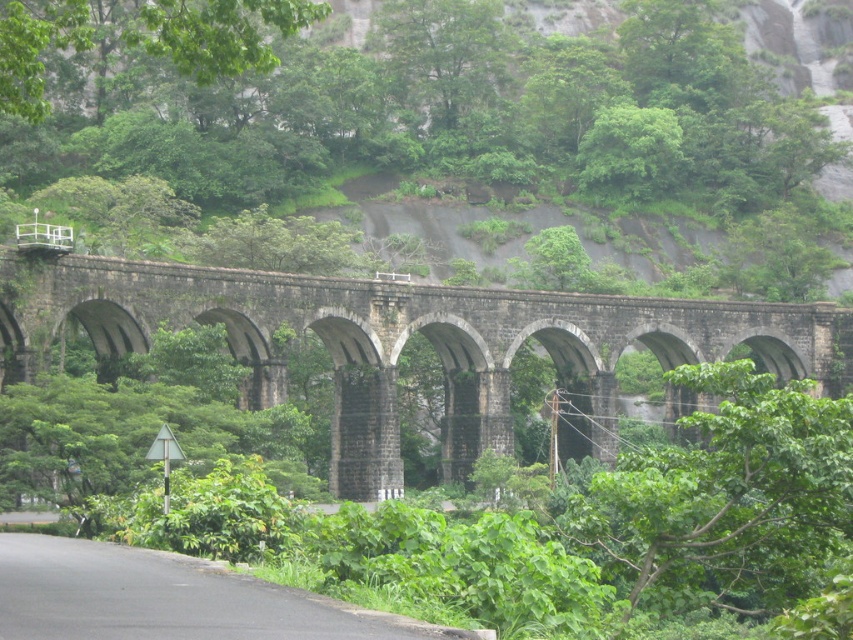
You are a hiker standing on the path near the dark gray stone bridge at center and the green leafy tree at upper center. Which object is higher up in the scene?

The green leafy tree at upper center is higher up in the scene because it is positioned above the dark gray stone bridge at center.

You are a railway engineer assessing the feasibility of a new track installation between the two closest arches of the dark gray stone bridge at center. The minimum required distance between arches for the new track is 250 feet. Can the existing structure accommodate this requirement?

The two closest arches of the dark gray stone bridge at center are 265.05 feet apart, which exceeds the minimum required distance of 250 feet. Therefore, the existing structure can accommodate the new track installation.

You are standing at the base of the stone railway viaduct and see two points marked in the image. The first point is at coordinate point (x=450, y=388) and the second is at point (x=241, y=56). If you were to walk directly towards the first point, would you encounter the second point before reaching the first one?

Point (x=450, y=388) is behind point (x=241, y=56), so walking towards the first point would mean the second point is closer to you. Therefore, you would encounter the second point before reaching the first one.